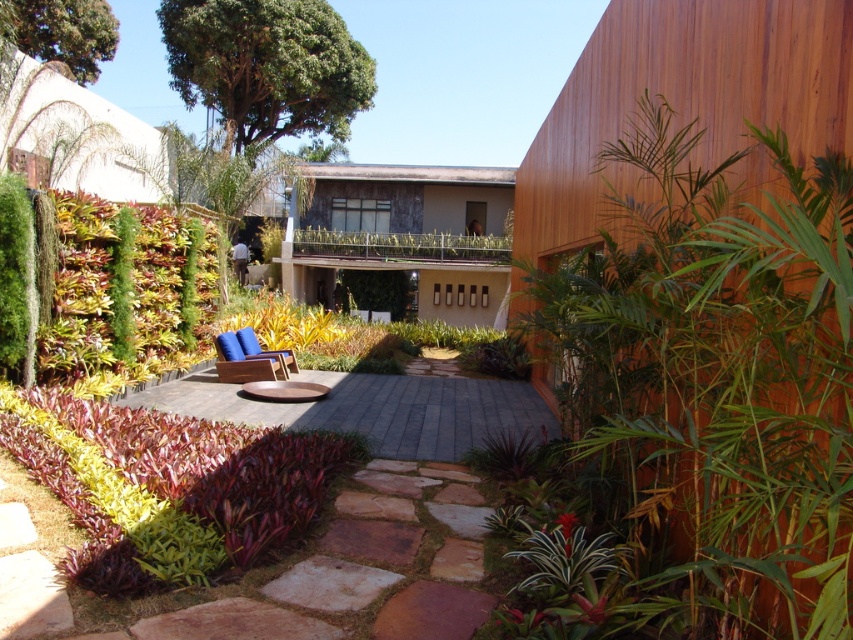
You are planning to place a new decorative item on the patio. The item requires a space that is wider than the green leafy plant at right but narrower than the blue fabric chair at center. Can you determine if there is a suitable spot between them?

The green leafy plant at right is thinner than the blue fabric chair at center, so there is a suitable spot between them for an item that requires a width between the two.